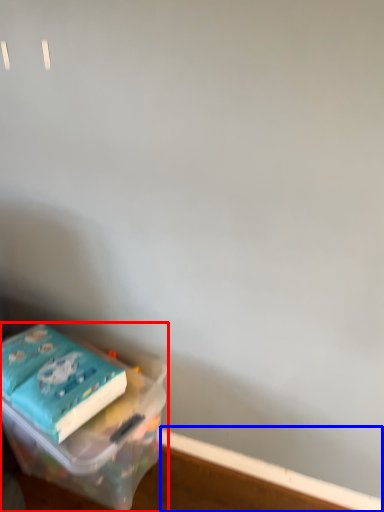
Question: Which of the following is the closest to the observer, box (highlighted by a red box) or window sill (highlighted by a blue box)?

Choices:
 (A) box
 (B) window sill

Answer: (A)